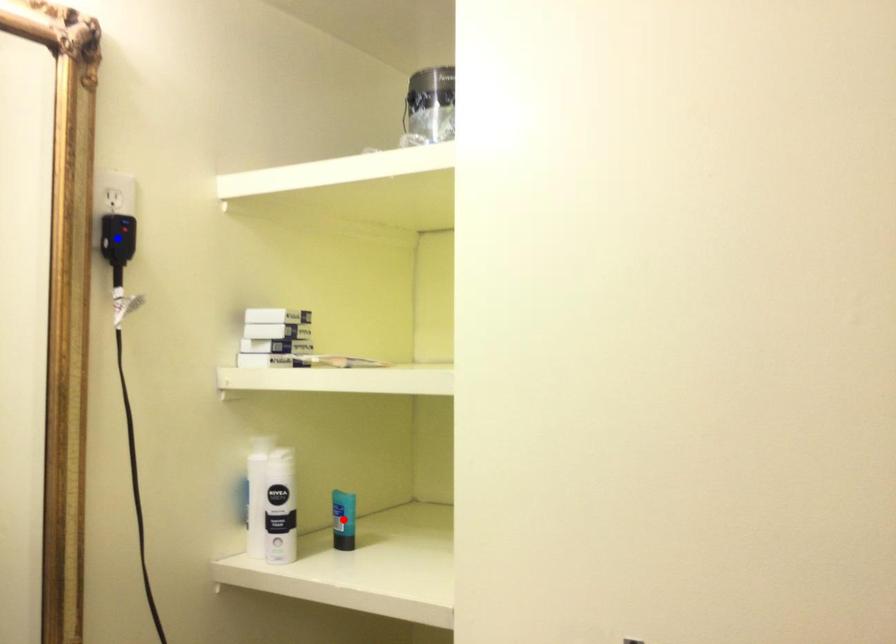
Question: Which of the two points in the image is closer to the camera?

Choices:
 (A) Blue point is closer.
 (B) Red point is closer.

Answer: (A)